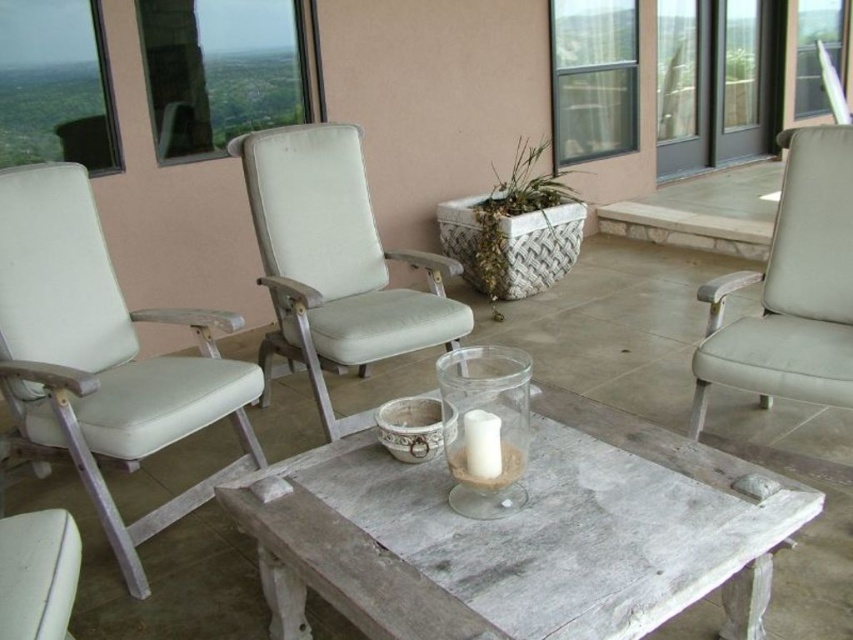
In the scene shown: Can you confirm if white leather armchair at left is positioned to the left of white fabric armchair at center?

Correct, you'll find white leather armchair at left to the left of white fabric armchair at center.

Between white leather armchair at left and white fabric armchair at center, which one has less height?

white fabric armchair at center

Which is behind, point (57, 248) or point (351, 272)?

The point (351, 272) is behind.

You are a GUI agent. You are given a task and a screenshot of the screen. Output one action in this format:
    pyautogui.click(x=<x>, y=<y>)
    Task: Click on the white leather armchair at left
    The height and width of the screenshot is (640, 853).
    Given the screenshot: What is the action you would take?
    pyautogui.click(x=103, y=355)

Between white leather armchair at left and light beige fabric armchair at right, which one is positioned lower?

white leather armchair at left is below.

Looking at this image, can you confirm if white leather armchair at left is positioned to the right of light beige fabric armchair at right?

Incorrect, white leather armchair at left is not on the right side of light beige fabric armchair at right.

The image size is (853, 640). In order to click on white leather armchair at left in this screenshot , I will do `click(103, 355)`.

Identify the location of white leather armchair at left. (103, 355).

Who is taller, white fabric armchair at center or light beige fabric armchair at right?

Standing taller between the two is white fabric armchair at center.

Can you confirm if white fabric armchair at center is wider than light beige fabric armchair at right?

Yes, white fabric armchair at center is wider than light beige fabric armchair at right.

Between point (339, 237) and point (793, 195), which one is positioned in front?

Point (793, 195) is more forward.

You are a GUI agent. You are given a task and a screenshot of the screen. Output one action in this format:
    pyautogui.click(x=<x>, y=<y>)
    Task: Click on the white fabric armchair at center
    Image resolution: width=853 pixels, height=640 pixels.
    Given the screenshot: What is the action you would take?
    pyautogui.click(x=334, y=262)